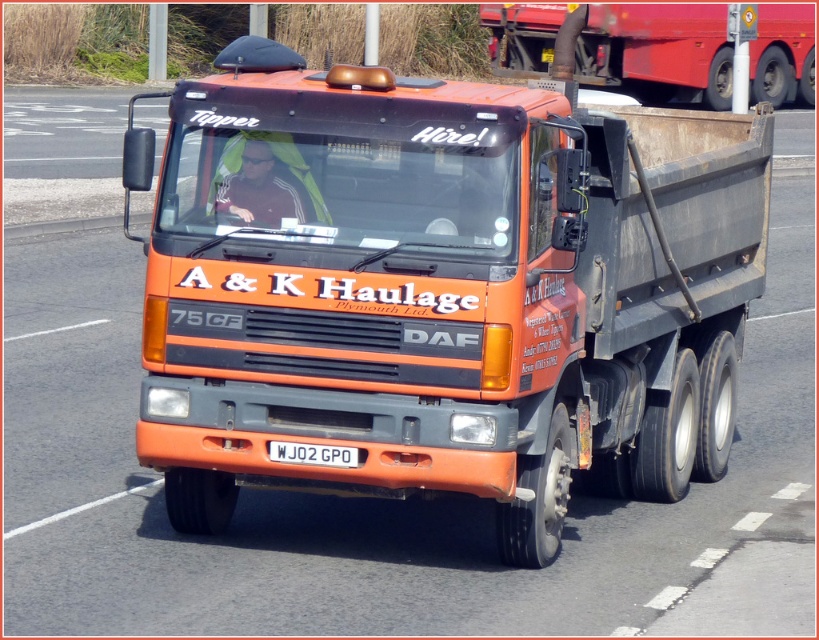
Does point (232, 109) come behind point (347, 451)?

Yes, point (232, 109) is farther from viewer.

Based on the photo, does orange matte trailer truck at center appear under white plastic license plate at center?

Actually, orange matte trailer truck at center is above white plastic license plate at center.

Find the location of `orange matte trailer truck at center`. orange matte trailer truck at center is located at coordinates (440, 291).